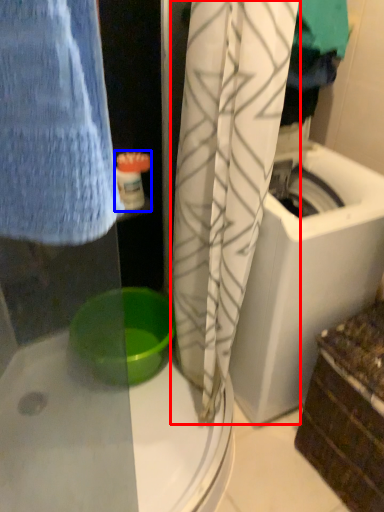
Question: Which object appears closest to the camera in this image, curtain (highlighted by a red box) or toiletry (highlighted by a blue box)?

Choices:
 (A) curtain
 (B) toiletry

Answer: (A)